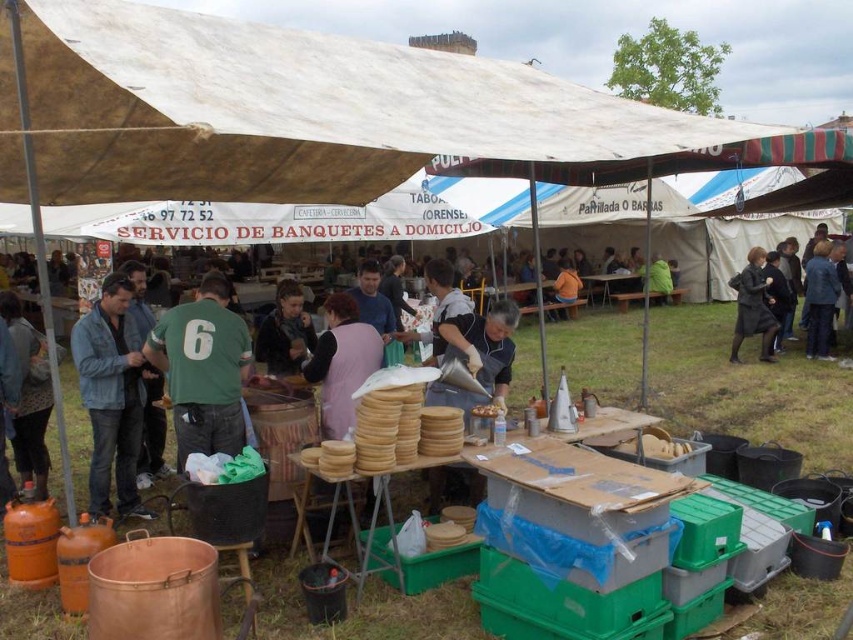
You are a delivery person standing at the entrance of the event area. You need to pick up an item located at point (641,285) and another item at point (556,301). Which item should you pick up first if you want to minimize your walking distance?

You should pick up the item at point (556,301) first because it is closer to you than the item at point (641,285), which is further away.

You are a customer at the event and want to place an order. You see the wooden table at center and the orange fabric shirt at center. Which object is closer to your eye level?

The orange fabric shirt at center is closer to your eye level because it is taller than the wooden table at center.

You are standing at the entrance of the event area and want to locate the wooden table at center. What are the coordinates where you should look to find it?

The wooden table at center is located at coordinates point (610,284).